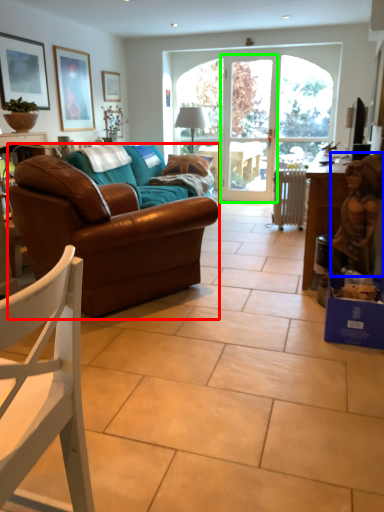
Question: Based on their relative distances, which object is farther from studio couch (highlighted by a red box)? Choose from person (highlighted by a blue box) and screen door (highlighted by a green box).

Choices:
 (A) person
 (B) screen door

Answer: (B)